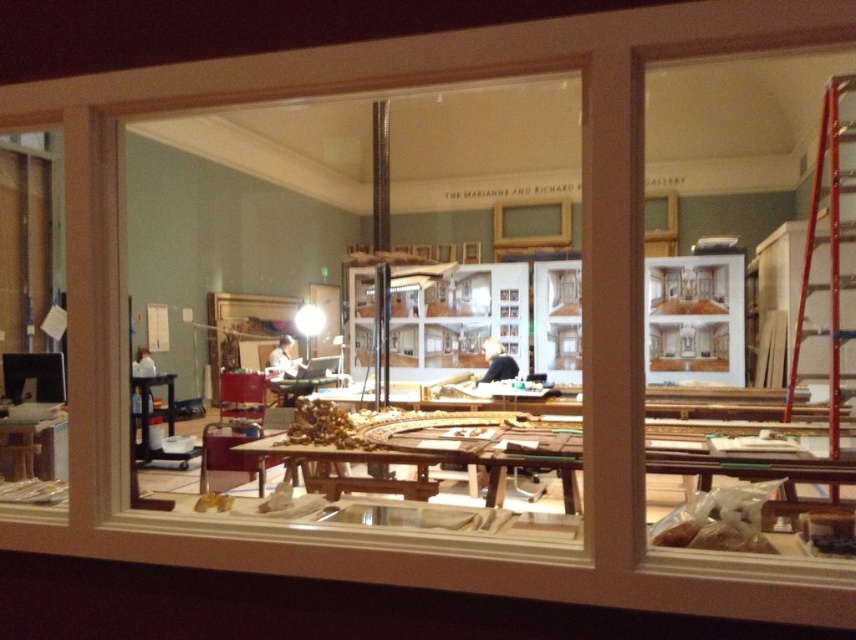
Question: Is red metal ladder at right below black fabric at center?

Choices:
 (A) yes
 (B) no

Answer: (B)

Question: Which point is farther to the camera?

Choices:
 (A) (849, 122)
 (B) (485, 339)

Answer: (B)

Question: Which of the following is the closest to the observer?

Choices:
 (A) black fabric at center
 (B) red metal ladder at right

Answer: (B)

Question: Is red metal ladder at right to the left of black fabric at center from the viewer's perspective?

Choices:
 (A) yes
 (B) no

Answer: (B)

Question: Is red metal ladder at right further to camera compared to black fabric at center?

Choices:
 (A) yes
 (B) no

Answer: (B)